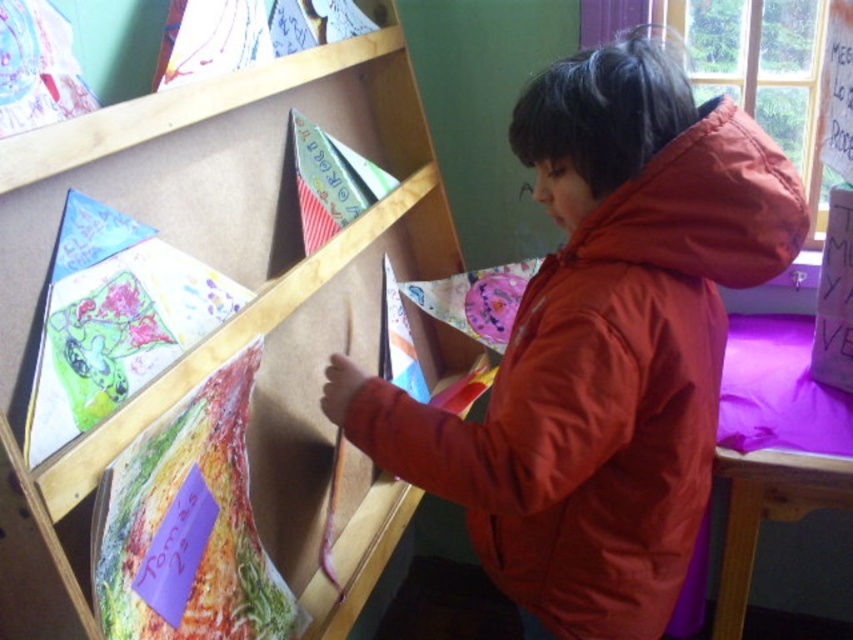
Does matte orange jacket at center have a greater height compared to wooden bookshelf at upper left?

No, matte orange jacket at center is not taller than wooden bookshelf at upper left.

Locate an element on the screen. The image size is (853, 640). matte orange jacket at center is located at coordinates (602, 346).

Is point (645, 230) in front of point (389, 234)?

Yes, point (645, 230) is in front of point (389, 234).

Image resolution: width=853 pixels, height=640 pixels. I want to click on matte orange jacket at center, so click(602, 346).